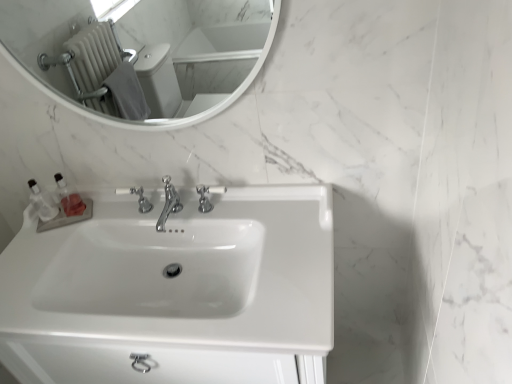
Identify the location of blank area to the left of chrome metallic faucet at center, acting as the first tap starting from the left. (88, 226).